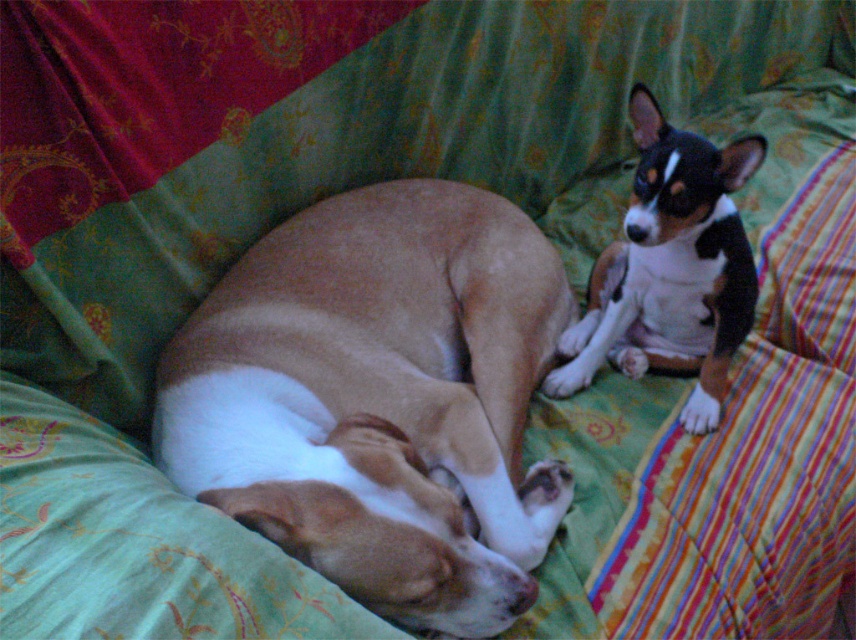
Does brown matte dog at center have a greater width compared to black and white fur at upper right?

Yes, brown matte dog at center is wider than black and white fur at upper right.

Who is positioned more to the left, brown matte dog at center or black and white fur at upper right?

Positioned to the left is brown matte dog at center.

Describe the element at coordinates (379, 397) in the screenshot. Image resolution: width=856 pixels, height=640 pixels. I see `brown matte dog at center` at that location.

Find the location of `brown matte dog at center`. brown matte dog at center is located at coordinates (379, 397).